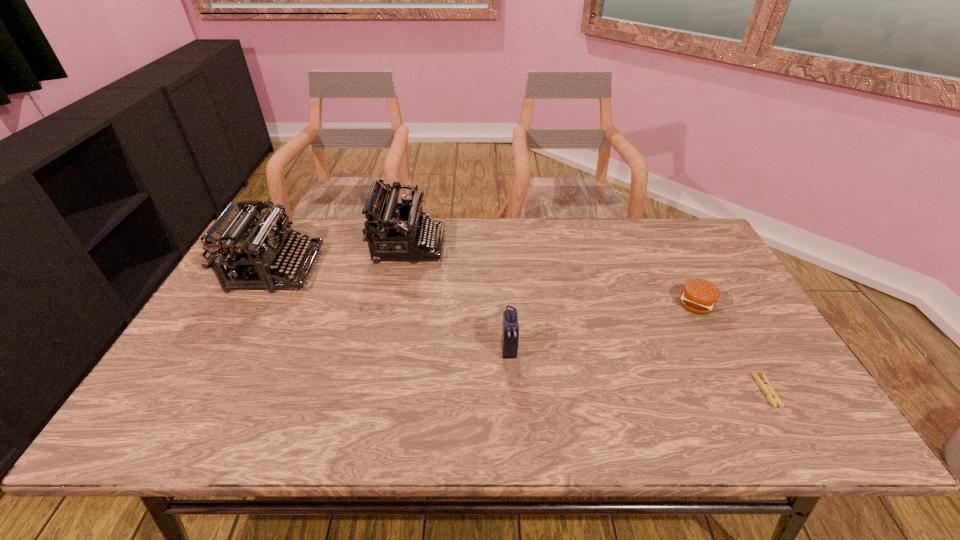
In the image, there is a desktop. Where is `vacant space at the left edge`? vacant space at the left edge is located at coordinates (252, 288).

I want to click on vacant space at the right edge of the desktop, so click(x=754, y=365).

This screenshot has width=960, height=540. I want to click on vacant space at the far left corner of the desktop, so click(x=309, y=222).

I want to click on free region at the near right corner, so click(x=768, y=438).

At what (x,y) coordinates should I click in order to perform the action: click on free space between the fourth object from right to left and the nearest object. Please return your answer as a coordinate pair (x, y). The width and height of the screenshot is (960, 540). Looking at the image, I should click on (588, 318).

At what (x,y) coordinates should I click in order to perform the action: click on free space between the shortest object and the hamburger. Please return your answer as a coordinate pair (x, y). Looking at the image, I should click on (731, 347).

The width and height of the screenshot is (960, 540). Identify the location of blank region between the right typewriter and the hamburger. [552, 274].

Where is `vacant point located between the leftmost object and the second shortest object`? The image size is (960, 540). vacant point located between the leftmost object and the second shortest object is located at coordinates (486, 286).

This screenshot has height=540, width=960. Identify the location of vacant space that is in between the left typewriter and the shortest object. (521, 330).

Identify the location of unoccupied area between the clutch bag and the nearest object. (637, 370).